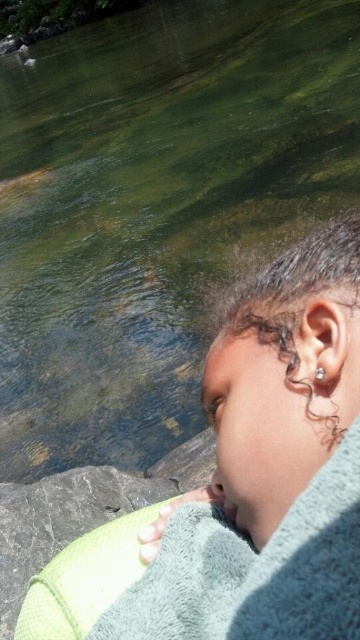
Can you confirm if green towel at lower right is positioned to the left of dark curly hair at right?

Correct, you'll find green towel at lower right to the left of dark curly hair at right.

Between point (358, 566) and point (288, 333), which one is positioned behind?

The point (288, 333) is behind.

What do you see at coordinates (254, 570) in the screenshot? I see `green towel at lower right` at bounding box center [254, 570].

The height and width of the screenshot is (640, 360). What are the coordinates of `green towel at lower right` in the screenshot? It's located at (254, 570).